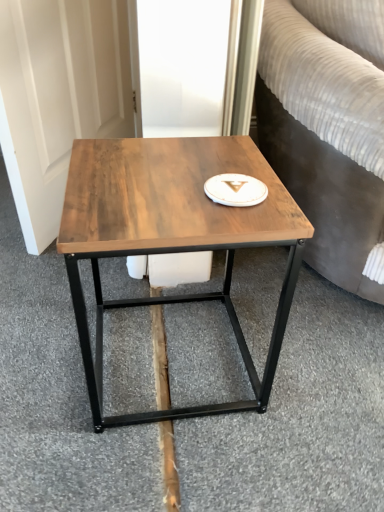
Find the location of a particular element. The image size is (384, 512). unoccupied space behind white glossy platter at center is located at coordinates (211, 157).